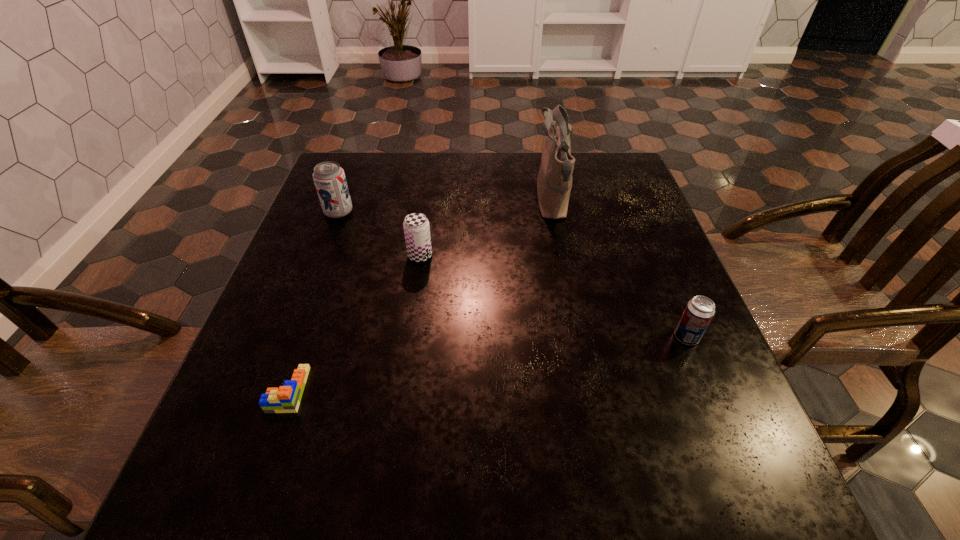
In order to click on free space in the image that satisfies the following two spatial constraints: 1. on the front-facing side of the rightmost object; 2. on the left side of the second object from right to left in this screenshot , I will do `click(579, 337)`.